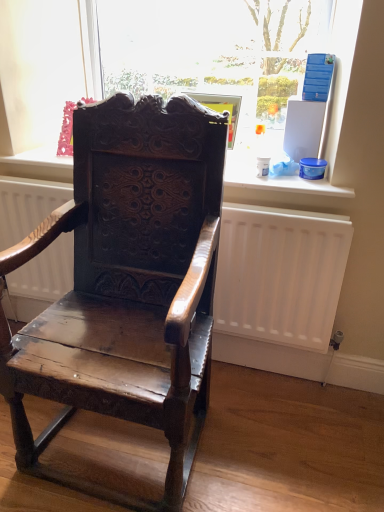
This screenshot has height=512, width=384. What are the coordinates of `vacant area in front of white matte radiator at center` in the screenshot? It's located at (160, 458).